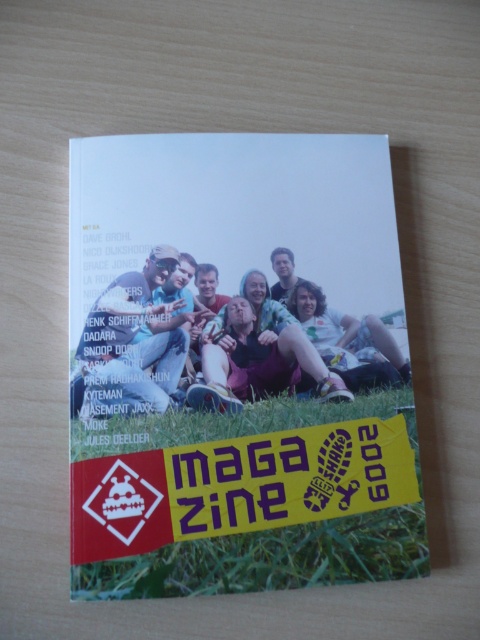
You are looking at the book cover of Maga Zine 2009. There is a point marked at coordinates point [253,500]. What is located at that point on the book cover?

The point [253,500] indicates green grass at lower center on the book cover.

You are an interior designer looking to match a client who has both the green grass at lower center and green fabric pants at center in their decor. Which of the two items has a larger width in the image?

The green grass at lower center might be wider than green fabric pants at center according to the description.